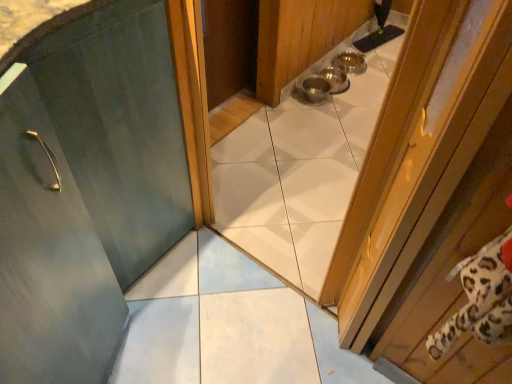
Locate an element on the screen. vacant area situated below matte green door at center, which is the 2th door from right to left (from a real-world perspective) is located at coordinates (170, 309).